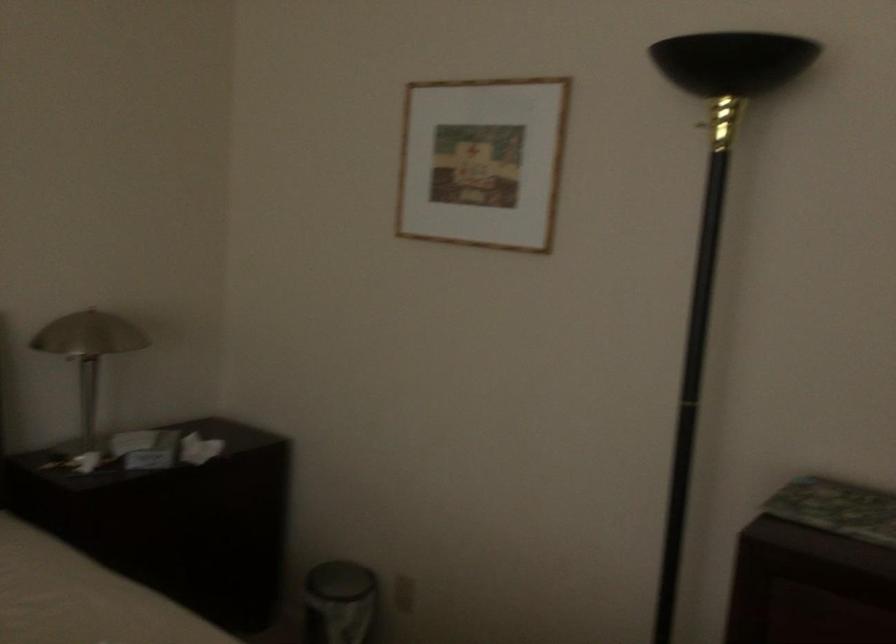
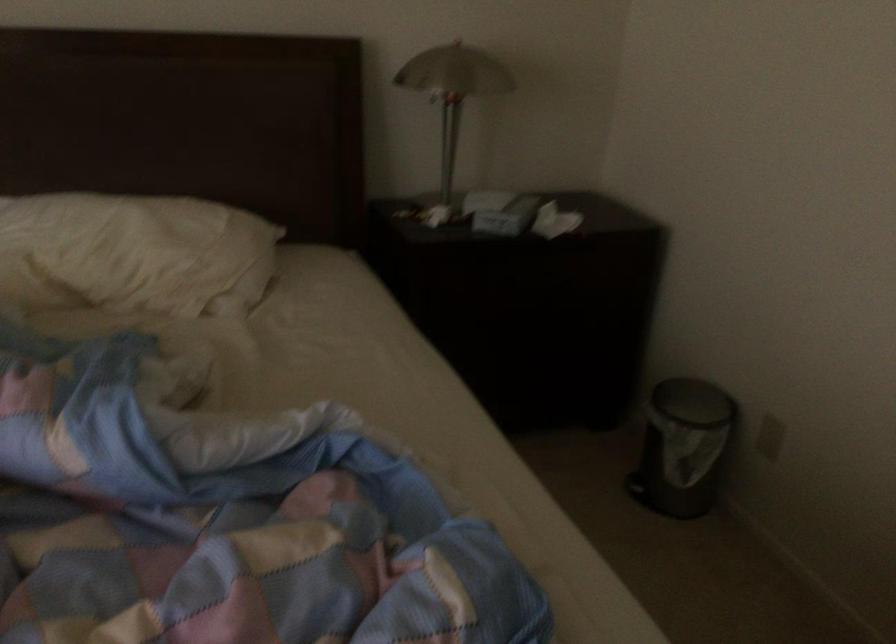
Locate, in the second image, the point that corresponds to the point at 156,450 in the first image.

(501, 212)